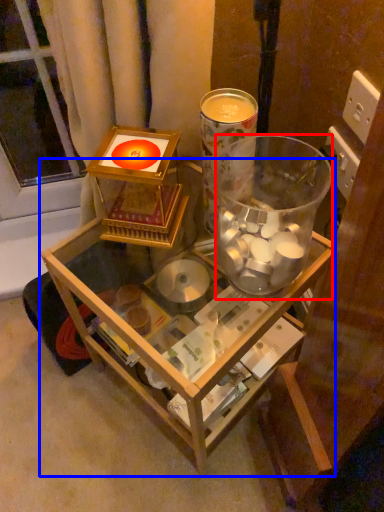
Question: Which of the following is the farthest to the observer, beverage (highlighted by a red box) or table (highlighted by a blue box)?

Choices:
 (A) beverage
 (B) table

Answer: (B)